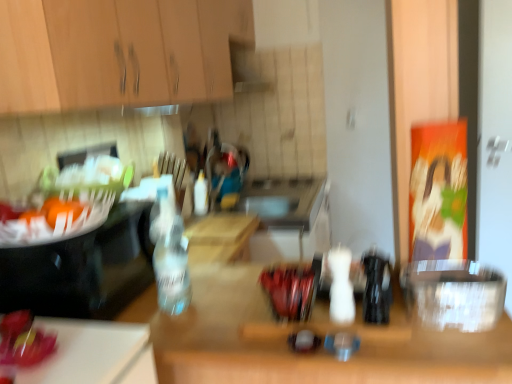
Where is `vacant space that is to the left of transparent plastic container at right, the second appliance positioned from the left`? This screenshot has width=512, height=384. vacant space that is to the left of transparent plastic container at right, the second appliance positioned from the left is located at coordinates (391, 322).